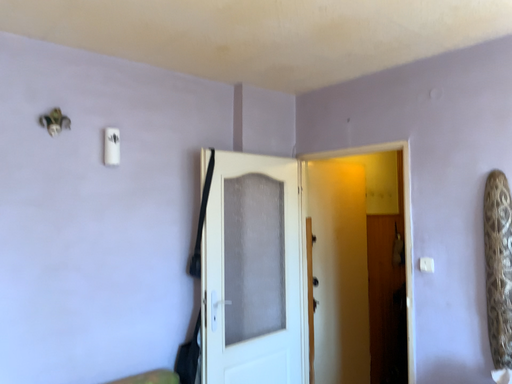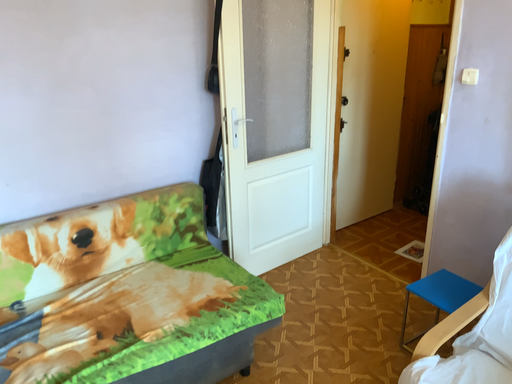
Question: Which way did the camera rotate in the video?

Choices:
 (A) rotated upward
 (B) rotated downward

Answer: (B)